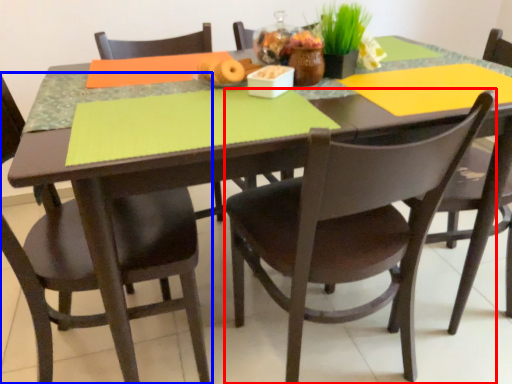
Question: Which of the following is the farthest to the observer, chair (highlighted by a red box) or chair (highlighted by a blue box)?

Choices:
 (A) chair
 (B) chair

Answer: (B)